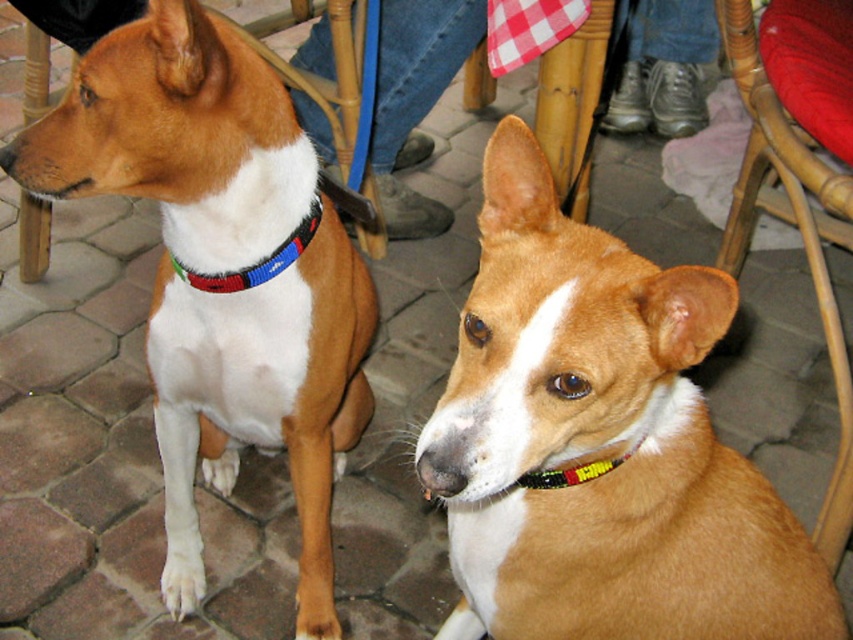
Question: Is brown shiny dog at center below multicolored beaded collar at center?

Choices:
 (A) yes
 (B) no

Answer: (A)

Question: Based on their relative distances, which object is farther from the brown shiny dog at center?

Choices:
 (A) brown and white fur at center
 (B) wooden chair at left
 (C) multicolored beaded collar at center
 (D) brown and white dog at center

Answer: (D)

Question: Can you confirm if brown and white fur at center is bigger than wooden chair at left?

Choices:
 (A) no
 (B) yes

Answer: (B)

Question: Which point appears closest to the camera in this image?

Choices:
 (A) (376, 173)
 (B) (602, 246)
 (C) (315, 193)

Answer: (B)

Question: Is brown shiny dog at center bigger than multicolored beaded collar at center?

Choices:
 (A) yes
 (B) no

Answer: (A)

Question: Which point is closer to the camera taking this photo?

Choices:
 (A) (820, 268)
 (B) (485, 522)
 (C) (376, 220)

Answer: (B)